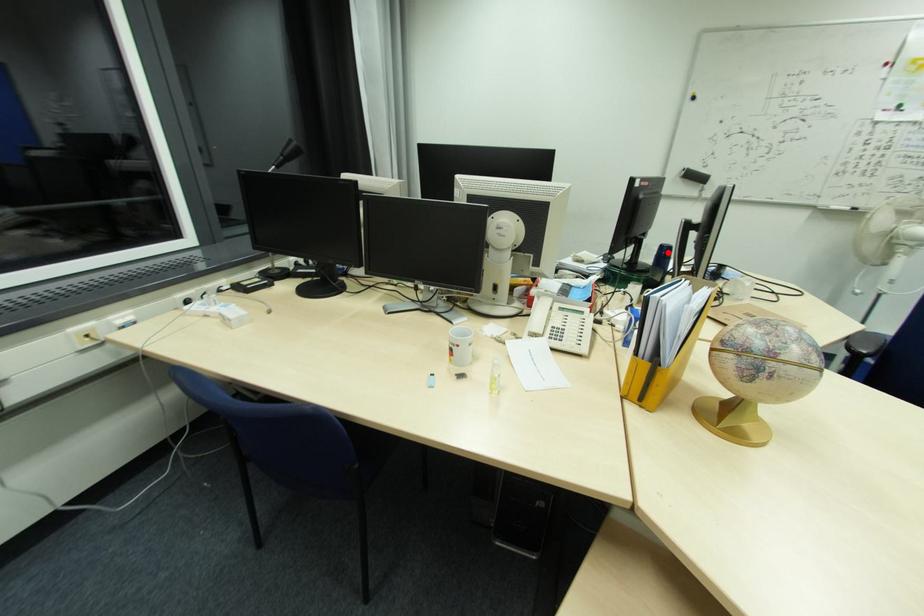
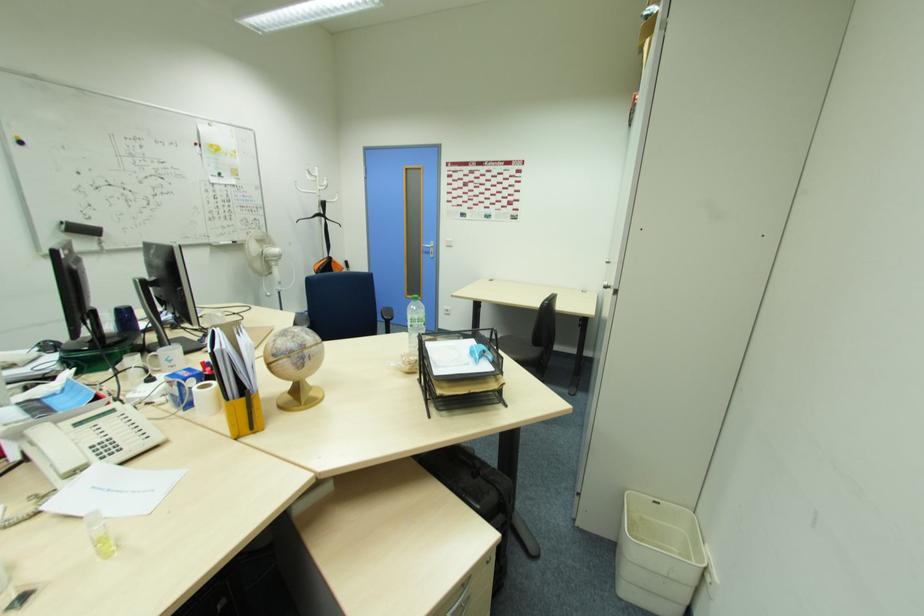
The point at the highlighted location is marked in the first image. Where is the corresponding point in the second image?

(128, 315)